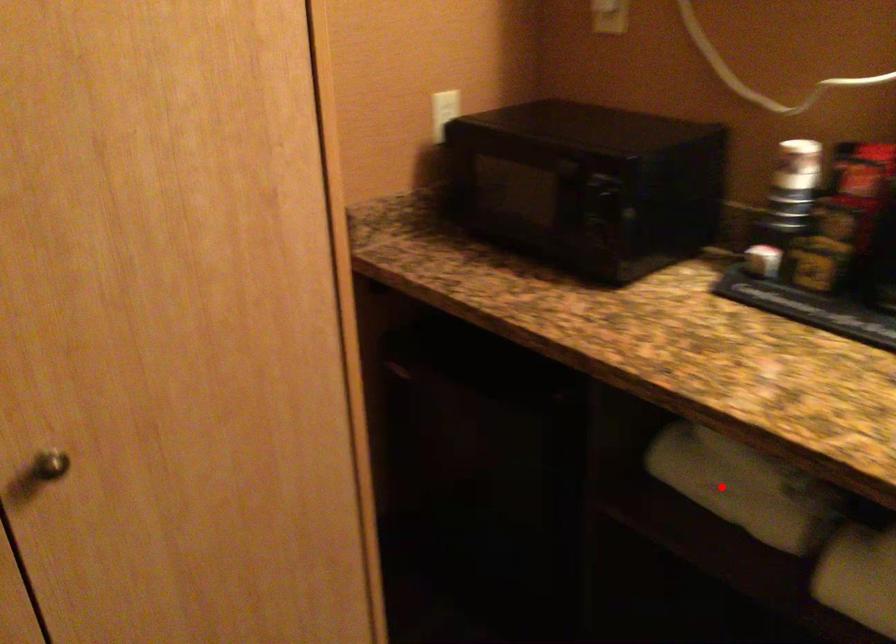
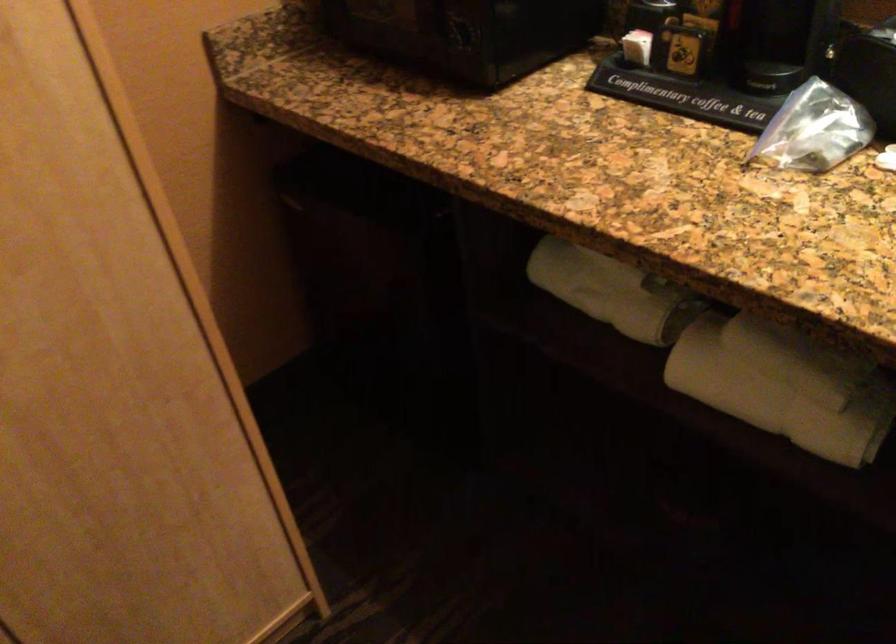
Where in the second image is the point corresponding to the highlighted location from the first image?

(596, 290)